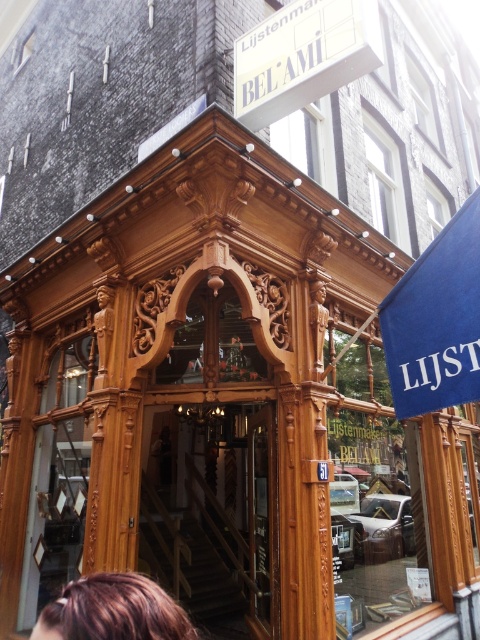
You are standing at the entrance of the building and notice two points marked on the facade. The first point is located at coordinates point (190, 508) and the second at point (364, 4). Which point is closer to you as you face the building?

Point (190, 508) is further to the viewer than point (364, 4), so the point closer to you is point (364, 4).

What is located at the point with coordinates (211, 509) in the image?

The wooden stairs at center are located at point (211, 509).

What is the relationship between the size of the white plastic sign at upper center and the brown hair at lower left?

The white plastic sign at upper center is larger in size than the brown hair at lower left.